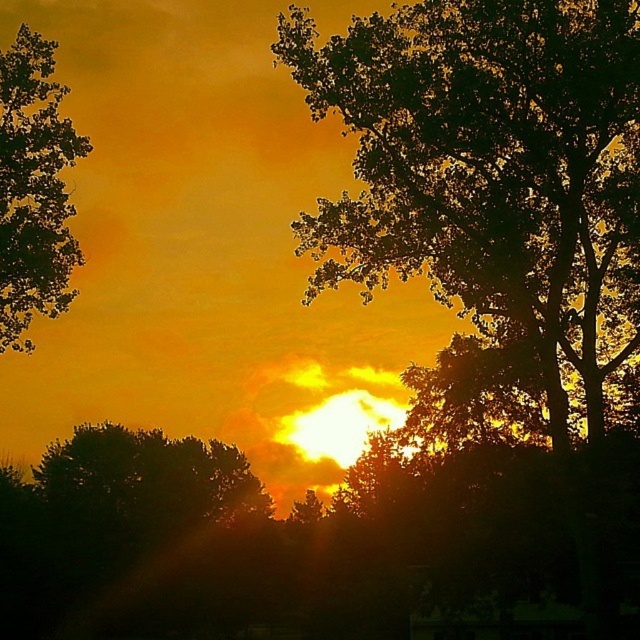
You are standing in the middle of a field and see the dark green leafy tree at center and the dark green leafy tree at left. Which tree is closer to your right side?

The dark green leafy tree at center is to the right of dark green leafy tree at left, so the dark green leafy tree at center is closer to your right side.

You are an artist trying to paint the sunset scene. You want to place the dark green leafy tree at center exactly at the coordinate point mentioned in the description. What are the coordinates where you should position it?

The dark green leafy tree at center should be positioned at the coordinates point (468, 148) as stated in the description.

You are an astronomer analyzing the sunset scene. You observe two points in the image, one at point (x=596, y=76) and another at point (x=33, y=58). Which point is closer to the viewer?

Point (x=596, y=76) is in front of point (x=33, y=58), so it is closer to the viewer.